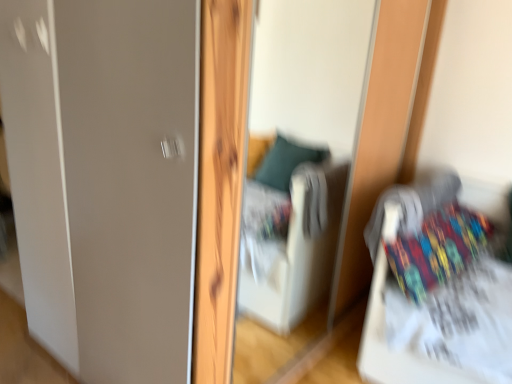
The height and width of the screenshot is (384, 512). What do you see at coordinates (438, 299) in the screenshot?
I see `multicolored fabric bed at right` at bounding box center [438, 299].

Locate an element on the screen. multicolored fabric bed at right is located at coordinates (438, 299).

Image resolution: width=512 pixels, height=384 pixels. I want to click on multicolored fabric bed at right, so pos(438,299).